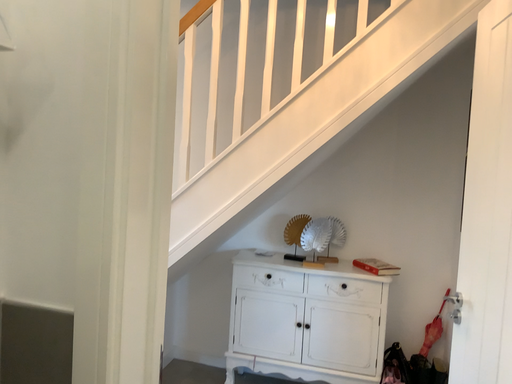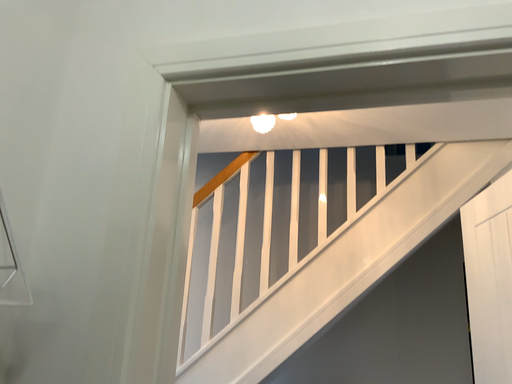
Question: How did the camera likely rotate when shooting the video?

Choices:
 (A) rotated upward
 (B) rotated downward

Answer: (A)